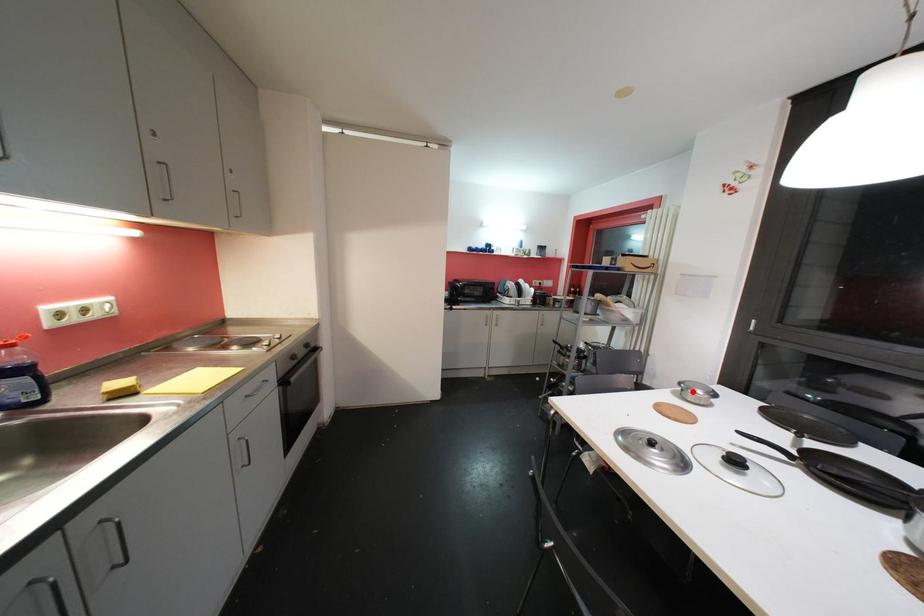
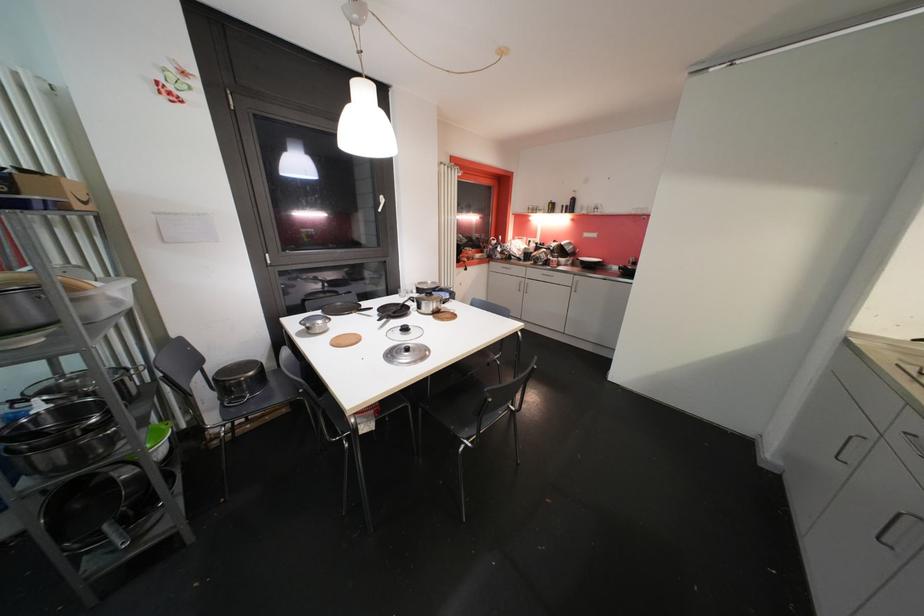
Where in the second image is the point corresponding to the highlighted location from the first image?

(319, 328)